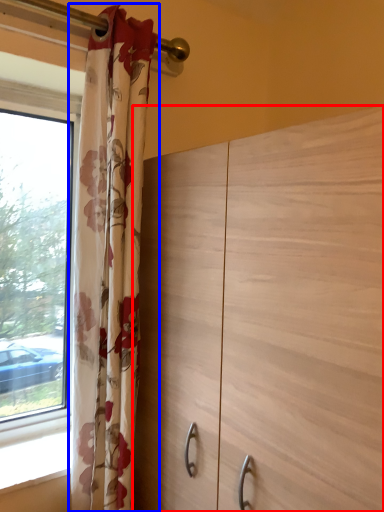
Question: Which point is further to the camera, dresser (highlighted by a red box) or curtain (highlighted by a blue box)?

Choices:
 (A) dresser
 (B) curtain

Answer: (B)